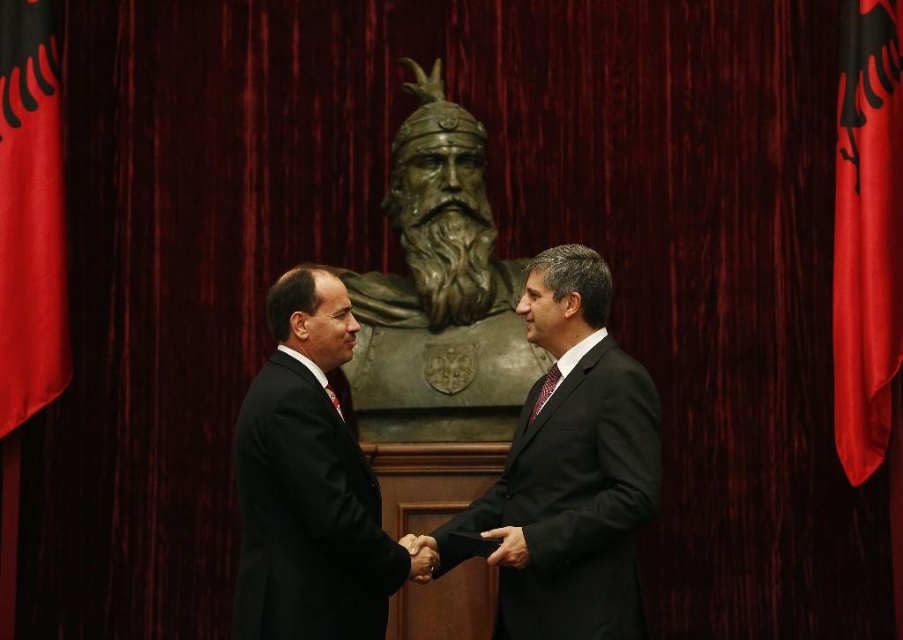
You are a photographer setting up for a formal event. You need to ensure that the black suit at center is visible above the bronze bust at center in the photo. Based on their heights, is this possible?

The black suit at center is shorter than the bronze bust at center, so it may not be possible to have the black suit at center visible above the bronze bust at center unless the photographer adjusts the angle or position.

Based on the photo, you are a photographer at a formal event and need to position a camera to capture both the black suit at center and the bronze bust at center in the same frame. Based on their positions, which object should be placed on the left side of the camera frame?

The black suit at center is to the left of the bronze bust at center, so the black suit at center should be placed on the left side of the camera frame.

You are a photographer adjusting your camera settings to capture the handshake between the two men. You notice two points in the scene at coordinates point (529, 602) and point (291, 509). Which point is closer to your camera lens?

Point (529, 602) is closer to the camera lens than point (291, 509).